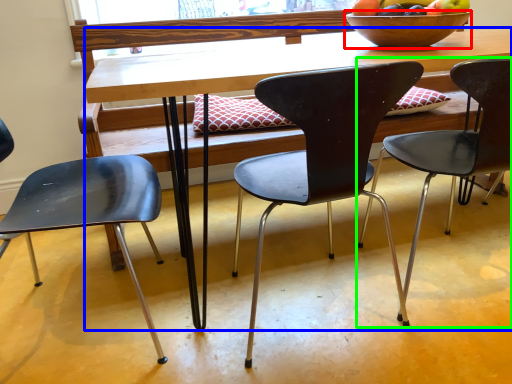
Question: Estimate the real-world distances between objects in this image. Which object is closer to bowl (highlighted by a red box), desk (highlighted by a blue box) or chair (highlighted by a green box)?

Choices:
 (A) desk
 (B) chair

Answer: (A)